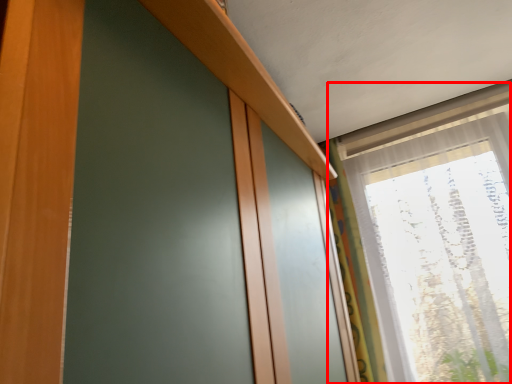
Question: From the image's perspective, where is window (annotated by the red box) located relative to curtain?

Choices:
 (A) below
 (B) above

Answer: (B)